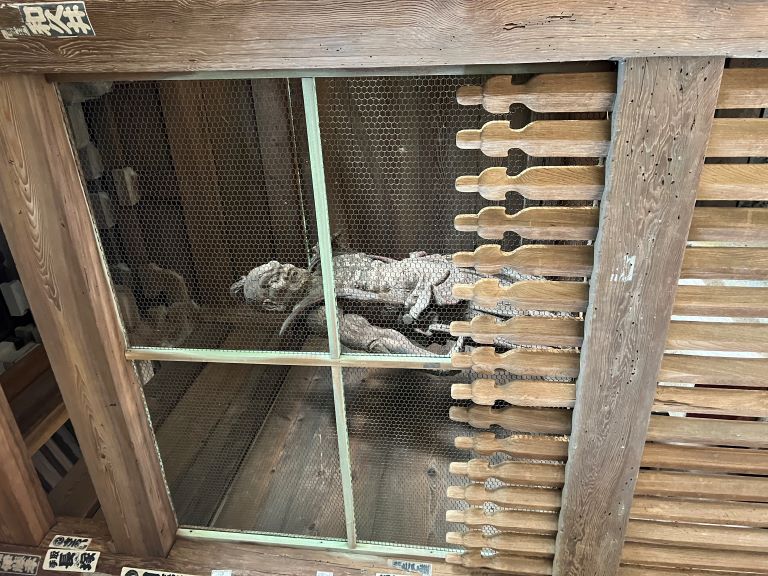
Locate an element on the screen. wood rafter is located at coordinates (77, 7), (124, 13).